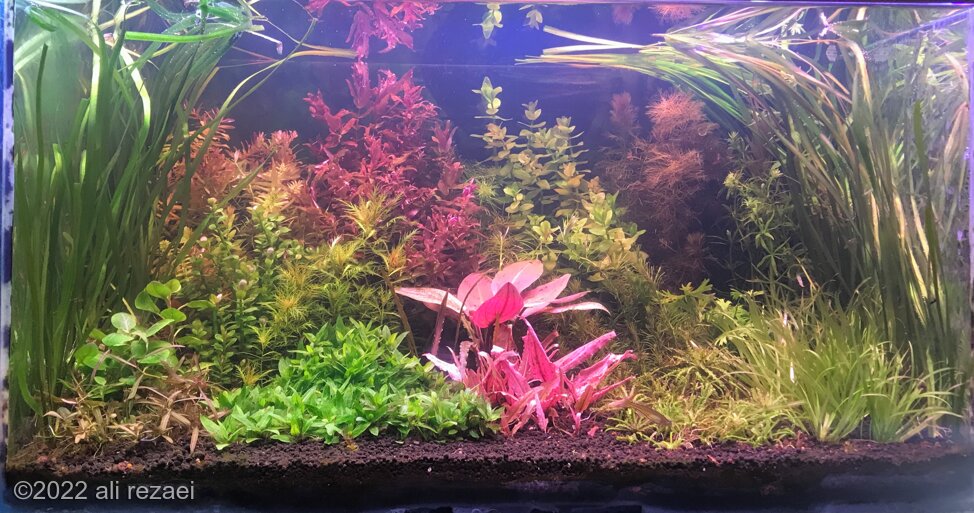
Identify the location of aquarium glass. The image size is (974, 513). (881, 486), (920, 433).